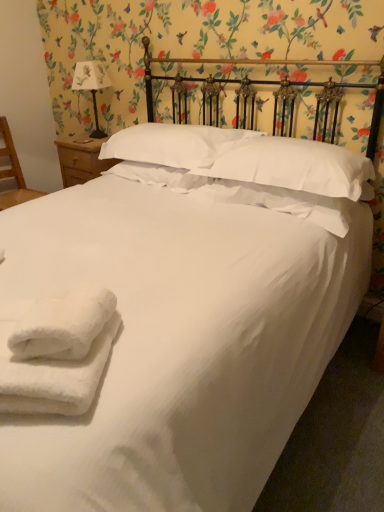
This screenshot has height=512, width=384. Identify the location of white fluffy towels at lower left. (53, 376).

You are a GUI agent. You are given a task and a screenshot of the screen. Output one action in this format:
    pyautogui.click(x=<x>, y=<y>)
    Task: Click on the white soft pillow at upper center, positioned as the third pillow in left-to-right order
    The height and width of the screenshot is (512, 384).
    Given the screenshot: What is the action you would take?
    pyautogui.click(x=291, y=165)

You are a GUI agent. You are given a task and a screenshot of the screen. Output one action in this format:
    pyautogui.click(x=<x>, y=<y>)
    Task: Click on the white paper-covered lampshade at upper left
    The image size is (384, 512).
    Given the screenshot: What is the action you would take?
    pyautogui.click(x=91, y=86)

Is wooden chair at left surrounded by white soft pillow at upper center, which is the first pillow from right to left?

No.

Is point (319, 186) positioned behind point (0, 196)?

That is False.

From the image's perspective, starting from the wooden chair at left, which pillow is the 1st one below? Please provide its 2D coordinates.

[(291, 165)]

From a real-world perspective, is white fluffy towels at lower left on top of white soft pillow at center, the first pillow from the left?

Actually, white fluffy towels at lower left is physically below white soft pillow at center, the first pillow from the left, in the real world.

Which is further, (x=101, y=368) or (x=168, y=158)?

Positioned behind is point (x=168, y=158).

Considering the relative sizes of white fluffy towels at lower left and white soft pillow at center, which is counted as the third pillow, starting from the right, in the image provided, is white fluffy towels at lower left thinner than white soft pillow at center, which is counted as the third pillow, starting from the right,?

Yes, white fluffy towels at lower left is thinner than white soft pillow at center, which is counted as the third pillow, starting from the right.

Is white fluffy towels at lower left next to white soft pillow at center, which is counted as the third pillow, starting from the right, and touching it?

white fluffy towels at lower left is not next to white soft pillow at center, which is counted as the third pillow, starting from the right, and they're not touching.

Between wooden nightstand at left and white textured pillow at center, positioned as the 2th pillow in right-to-left order, which one is positioned behind?

wooden nightstand at left is behind.

From the image's perspective, is wooden nightstand at left above white textured pillow at center, the 2th pillow when ordered from left to right?

Yes, from the image's perspective, wooden nightstand at left is over white textured pillow at center, the 2th pillow when ordered from left to right.

Which object is positioned more to the right, wooden nightstand at left or white textured pillow at center, the 2th pillow when ordered from left to right?

From the viewer's perspective, white textured pillow at center, the 2th pillow when ordered from left to right, appears more on the right side.

Is wooden nightstand at left far away from white textured pillow at center, the 2th pillow when ordered from left to right?

Actually, wooden nightstand at left and white textured pillow at center, the 2th pillow when ordered from left to right, are a little close together.

How distant is white soft pillow at upper center, which is the first pillow from right to left, from white paper-covered lampshade at upper left?

They are 4.51 feet apart.

Between point (222, 167) and point (99, 70), which one is positioned in front?

The point (222, 167) is in front.

How different are the orientations of white soft pillow at upper center, positioned as the third pillow in left-to-right order, and white paper-covered lampshade at upper left in degrees?

The angle between the facing direction of white soft pillow at upper center, positioned as the third pillow in left-to-right order, and the facing direction of white paper-covered lampshade at upper left is 3.98 degrees.

Which object is positioned more to the right, white soft pillow at upper center, which is the first pillow from right to left, or white paper-covered lampshade at upper left?

From the viewer's perspective, white soft pillow at upper center, which is the first pillow from right to left, appears more on the right side.

Does white paper-covered lampshade at upper left contain wooden nightstand at left?

Definitely not — wooden nightstand at left is not inside white paper-covered lampshade at upper left.

From a real-world perspective, is white paper-covered lampshade at upper left positioned above or below wooden nightstand at left?

white paper-covered lampshade at upper left is above wooden nightstand at left.

Considering the points (97, 123) and (106, 140), which point is behind, point (97, 123) or point (106, 140)?

The point (97, 123) is farther from the camera.

Consider the image. Could you tell me if white paper-covered lampshade at upper left is turned towards wooden nightstand at left?

No, white paper-covered lampshade at upper left is not aimed at wooden nightstand at left.

Considering the sizes of objects white soft pillow at center, the first pillow from the left, and white paper-covered lampshade at upper left in the image provided, who is wider, white soft pillow at center, the first pillow from the left, or white paper-covered lampshade at upper left?

white soft pillow at center, the first pillow from the left.

Is white soft pillow at center, which is counted as the third pillow, starting from the right, positioned far away from white paper-covered lampshade at upper left?

They are positioned close to each other.

Is white soft pillow at center, the first pillow from the left, oriented towards white paper-covered lampshade at upper left?

No.

Does white soft pillow at center, which is counted as the third pillow, starting from the right, touch white textured pillow at center, positioned as the 2th pillow in right-to-left order?

They are not placed beside each other.

Is white soft pillow at center, which is counted as the third pillow, starting from the right, bigger than white textured pillow at center, the 2th pillow when ordered from left to right?

Indeed, white soft pillow at center, which is counted as the third pillow, starting from the right, has a larger size compared to white textured pillow at center, the 2th pillow when ordered from left to right.

Considering the relative sizes of white soft pillow at center, which is counted as the third pillow, starting from the right, and white textured pillow at center, the 2th pillow when ordered from left to right, in the image provided, is white soft pillow at center, which is counted as the third pillow, starting from the right, thinner than white textured pillow at center, the 2th pillow when ordered from left to right,?

Correct, the width of white soft pillow at center, which is counted as the third pillow, starting from the right, is less than that of white textured pillow at center, the 2th pillow when ordered from left to right.

Is white soft pillow at center, the first pillow from the left, closer to camera compared to white textured pillow at center, the 2th pillow when ordered from left to right?

No, white soft pillow at center, the first pillow from the left, is further to the viewer.

From a real-world perspective, which pillow is the 3rd one above the wooden chair at left? Please provide its 2D coordinates.

[(291, 165)]

You are a GUI agent. You are given a task and a screenshot of the screen. Output one action in this format:
    pyautogui.click(x=<x>, y=<y>)
    Task: Click on the towel in front of the white soft pillow at center, which is counted as the third pillow, starting from the right
    The height and width of the screenshot is (512, 384).
    Given the screenshot: What is the action you would take?
    pyautogui.click(x=53, y=376)

Estimate the real-world distances between objects in this image. Which object is further from white paper-covered lampshade at upper left, white textured pillow at center, the 2th pillow when ordered from left to right, or white fluffy towels at lower left?

white fluffy towels at lower left lies further to white paper-covered lampshade at upper left than the other object.

Considering their positions, is white soft pillow at center, which is counted as the third pillow, starting from the right, positioned closer to wooden chair at left than wooden nightstand at left?

Based on the image, wooden nightstand at left appears to be nearer to wooden chair at left.

Consider the image. When comparing their distances from wooden nightstand at left, does white textured pillow at center, the 2th pillow when ordered from left to right, or white fluffy towels at lower left seem further?

The object further to wooden nightstand at left is white fluffy towels at lower left.

When comparing their distances from wooden chair at left, does white paper-covered lampshade at upper left or white soft pillow at upper center, positioned as the third pillow in left-to-right order, seem further?

white soft pillow at upper center, positioned as the third pillow in left-to-right order, is positioned further to the anchor wooden chair at left.

Looking at the image, which one is located further to wooden chair at left, white soft pillow at center, the first pillow from the left, or white paper-covered lampshade at upper left?

white soft pillow at center, the first pillow from the left, is positioned further to the anchor wooden chair at left.

Considering their positions, is white soft pillow at center, which is counted as the third pillow, starting from the right, positioned closer to white paper-covered lampshade at upper left than wooden nightstand at left?

Based on the image, wooden nightstand at left appears to be nearer to white paper-covered lampshade at upper left.

Which object lies nearer to the anchor point white soft pillow at center, the first pillow from the left, white paper-covered lampshade at upper left or wooden nightstand at left?

wooden nightstand at left.

Based on their spatial positions, is wooden chair at left or wooden nightstand at left closer to white paper-covered lampshade at upper left?

wooden nightstand at left is closer to white paper-covered lampshade at upper left.

I want to click on towel between wooden chair at left and white soft pillow at upper center, which is the first pillow from right to left, so click(53, 376).

You are a GUI agent. You are given a task and a screenshot of the screen. Output one action in this format:
    pyautogui.click(x=<x>, y=<y>)
    Task: Click on the nightstand between wooden chair at left and white soft pillow at upper center, which is the first pillow from right to left
    The height and width of the screenshot is (512, 384).
    Given the screenshot: What is the action you would take?
    pyautogui.click(x=81, y=159)

I want to click on pillow between wooden chair at left and white textured pillow at center, positioned as the 2th pillow in right-to-left order, so click(x=174, y=144).

This screenshot has width=384, height=512. Find the location of `armchair positioned between white fluffy towels at lower left and wooden nightstand at left from near to far`. armchair positioned between white fluffy towels at lower left and wooden nightstand at left from near to far is located at coordinates (13, 172).